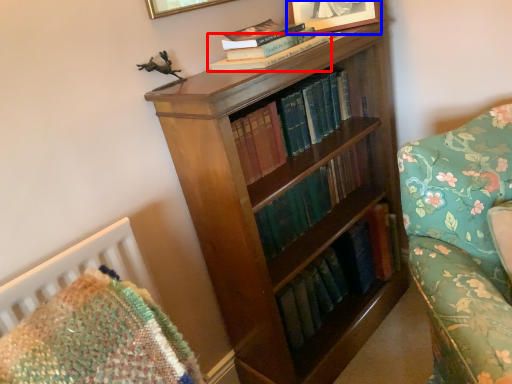
Question: Among these objects, which one is farthest to the camera, book (highlighted by a red box) or picture frame (highlighted by a blue box)?

Choices:
 (A) book
 (B) picture frame

Answer: (B)